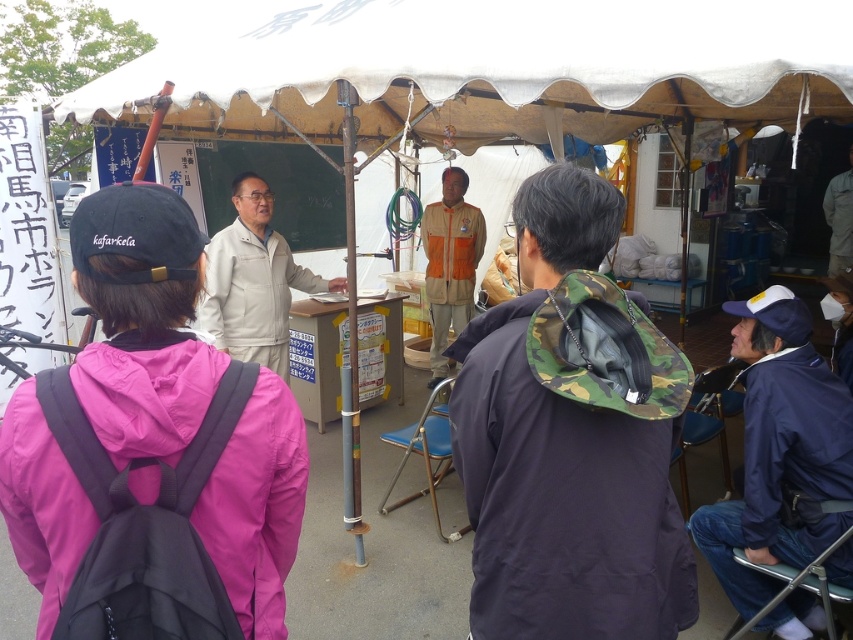
You are organizing a clothing donation drive and need to stack the pink fabric jacket at center and the beige fabric jacket at center vertically in a narrow closet. Which jacket should you place at the bottom to ensure both fit without exceeding the closet height?

The pink fabric jacket at center is thinner than the beige fabric jacket at center, so placing the thinner pink fabric jacket at center at the bottom allows the thicker beige fabric jacket at center to be placed on top without exceeding the closet height.